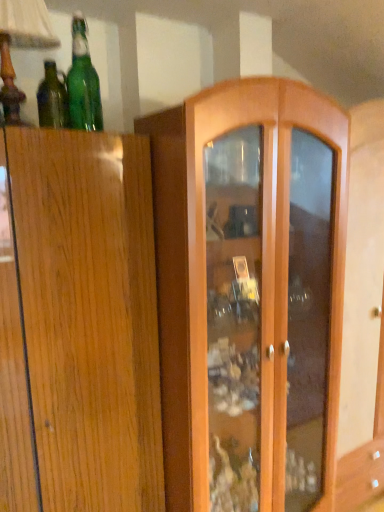
What do you see at coordinates (83, 82) in the screenshot? I see `green glass bottle at upper left, placed as the first bottle when sorted from right to left` at bounding box center [83, 82].

Describe the element at coordinates (52, 99) in the screenshot. I see `green glass bottle at upper left, placed as the 2th bottle when sorted from right to left` at that location.

Locate an element on the screen. This screenshot has height=512, width=384. green glass bottle at upper left, which appears as the 2th bottle when viewed from the left is located at coordinates (83, 82).

Is green glass bottle at upper left, placed as the 2th bottle when sorted from right to left, not near green glass bottle at upper left, which appears as the 2th bottle when viewed from the left?

green glass bottle at upper left, placed as the 2th bottle when sorted from right to left, is near green glass bottle at upper left, which appears as the 2th bottle when viewed from the left, not far away.

What are the coordinates of `bottle on the right of green glass bottle at upper left, placed as the 2th bottle when sorted from right to left` in the screenshot? It's located at (83, 82).

Consider the image. From their relative heights in the image, would you say green glass bottle at upper left, the 1th bottle positioned from the left, is taller or shorter than green glass bottle at upper left, which appears as the 2th bottle when viewed from the left?

In the image, green glass bottle at upper left, the 1th bottle positioned from the left, appears to be shorter than green glass bottle at upper left, which appears as the 2th bottle when viewed from the left.

Could you measure the distance between wooden table lamp at upper left and green glass bottle at upper left, the 1th bottle positioned from the left?

wooden table lamp at upper left is 9.53 inches away from green glass bottle at upper left, the 1th bottle positioned from the left.

Looking at this image, considering the sizes of objects wooden table lamp at upper left and green glass bottle at upper left, placed as the 2th bottle when sorted from right to left, in the image provided, who is taller, wooden table lamp at upper left or green glass bottle at upper left, placed as the 2th bottle when sorted from right to left,?

Standing taller between the two is wooden table lamp at upper left.

From a real-world perspective, count 2nd bottles downward from the wooden table lamp at upper left and point to it. Please provide its 2D coordinates.

[(52, 99)]

From a real-world perspective, is wooden table lamp at upper left physically located above or below green glass bottle at upper left, placed as the 2th bottle when sorted from right to left?

In terms of real-world spatial position, wooden table lamp at upper left is above green glass bottle at upper left, placed as the 2th bottle when sorted from right to left.

From the image's perspective, is green glass bottle at upper left, the 1th bottle positioned from the left, beneath wooden table lamp at upper left?

Yes, from the image's perspective, green glass bottle at upper left, the 1th bottle positioned from the left, is beneath wooden table lamp at upper left.

Considering the positions of objects green glass bottle at upper left, the 1th bottle positioned from the left, and wooden table lamp at upper left in the image provided, who is more to the left, green glass bottle at upper left, the 1th bottle positioned from the left, or wooden table lamp at upper left?

Positioned to the left is wooden table lamp at upper left.

Is green glass bottle at upper left, placed as the 2th bottle when sorted from right to left, aimed at wooden table lamp at upper left?

Yes, green glass bottle at upper left, placed as the 2th bottle when sorted from right to left, is turned towards wooden table lamp at upper left.

At what (x,y) coordinates should I click in order to perform the action: click on the 2nd bottle behind the wooden table lamp at upper left, counting from the anchor's position. Please return your answer as a coordinate pair (x, y). This screenshot has width=384, height=512. Looking at the image, I should click on (52, 99).

Which object is closer to the camera, wooden table lamp at upper left or green glass bottle at upper left, placed as the first bottle when sorted from right to left?

wooden table lamp at upper left is more forward.

Is wooden table lamp at upper left far from green glass bottle at upper left, placed as the first bottle when sorted from right to left?

No, there isn't a large distance between wooden table lamp at upper left and green glass bottle at upper left, placed as the first bottle when sorted from right to left.

Does point (3, 37) come farther from viewer compared to point (83, 47)?

No, it is in front of (83, 47).

Is wooden table lamp at upper left aimed at green glass bottle at upper left, placed as the first bottle when sorted from right to left?

No, wooden table lamp at upper left does not turn towards green glass bottle at upper left, placed as the first bottle when sorted from right to left.

Is point (75, 31) behind point (43, 82)?

That is False.

From a real-world perspective, is green glass bottle at upper left, which appears as the 2th bottle when viewed from the left, under green glass bottle at upper left, the 1th bottle positioned from the left?

No.

Where is `bottle below the green glass bottle at upper left, placed as the first bottle when sorted from right to left (from the image's perspective)`? The height and width of the screenshot is (512, 384). bottle below the green glass bottle at upper left, placed as the first bottle when sorted from right to left (from the image's perspective) is located at coordinates point(52,99).

Is green glass bottle at upper left, placed as the first bottle when sorted from right to left, facing away from green glass bottle at upper left, the 1th bottle positioned from the left?

green glass bottle at upper left, placed as the first bottle when sorted from right to left, does not have its back to green glass bottle at upper left, the 1th bottle positioned from the left.

Can you confirm if green glass bottle at upper left, placed as the first bottle when sorted from right to left, is taller than wooden table lamp at upper left?

In fact, green glass bottle at upper left, placed as the first bottle when sorted from right to left, may be shorter than wooden table lamp at upper left.

Which object is further away from the camera taking this photo, green glass bottle at upper left, which appears as the 2th bottle when viewed from the left, or wooden table lamp at upper left?

green glass bottle at upper left, which appears as the 2th bottle when viewed from the left.

Is green glass bottle at upper left, placed as the first bottle when sorted from right to left, positioned beyond the bounds of wooden table lamp at upper left?

Yes, green glass bottle at upper left, placed as the first bottle when sorted from right to left, is outside of wooden table lamp at upper left.

How different are the orientations of green glass bottle at upper left, which appears as the 2th bottle when viewed from the left, and wooden table lamp at upper left in degrees?

green glass bottle at upper left, which appears as the 2th bottle when viewed from the left, and wooden table lamp at upper left are facing 0.00043 degrees away from each other.

In the image, there is a green glass bottle at upper left, the 1th bottle positioned from the left. Where is `bottle above it (from the image's perspective)`? The image size is (384, 512). bottle above it (from the image's perspective) is located at coordinates (83, 82).

The image size is (384, 512). Find the location of `table lamp on the left of green glass bottle at upper left, the 1th bottle positioned from the left`. table lamp on the left of green glass bottle at upper left, the 1th bottle positioned from the left is located at coordinates (21, 47).

When comparing their distances from wooden table lamp at upper left, does green glass bottle at upper left, the 1th bottle positioned from the left, or green glass bottle at upper left, placed as the first bottle when sorted from right to left, seem further?

green glass bottle at upper left, the 1th bottle positioned from the left, is further to wooden table lamp at upper left.

Consider the image. Which object lies further to the anchor point wooden table lamp at upper left, green glass bottle at upper left, which appears as the 2th bottle when viewed from the left, or green glass bottle at upper left, the 1th bottle positioned from the left?

green glass bottle at upper left, the 1th bottle positioned from the left.

From the picture: When comparing their distances from green glass bottle at upper left, placed as the first bottle when sorted from right to left, does green glass bottle at upper left, the 1th bottle positioned from the left, or wooden table lamp at upper left seem closer?

green glass bottle at upper left, the 1th bottle positioned from the left, lies closer to green glass bottle at upper left, placed as the first bottle when sorted from right to left, than the other object.

Looking at the image, which one is located further to green glass bottle at upper left, the 1th bottle positioned from the left, wooden table lamp at upper left or green glass bottle at upper left, placed as the first bottle when sorted from right to left?

The object further to green glass bottle at upper left, the 1th bottle positioned from the left, is wooden table lamp at upper left.

Based on their spatial positions, is wooden table lamp at upper left or green glass bottle at upper left, placed as the 2th bottle when sorted from right to left, further from green glass bottle at upper left, placed as the first bottle when sorted from right to left?

wooden table lamp at upper left lies further to green glass bottle at upper left, placed as the first bottle when sorted from right to left, than the other object.

Estimate the real-world distances between objects in this image. Which object is further from green glass bottle at upper left, placed as the 2th bottle when sorted from right to left, green glass bottle at upper left, which appears as the 2th bottle when viewed from the left, or wooden table lamp at upper left?

wooden table lamp at upper left lies further to green glass bottle at upper left, placed as the 2th bottle when sorted from right to left, than the other object.

Locate an element on the screen. bottle between wooden table lamp at upper left and green glass bottle at upper left, placed as the 2th bottle when sorted from right to left, along the z-axis is located at coordinates (83, 82).